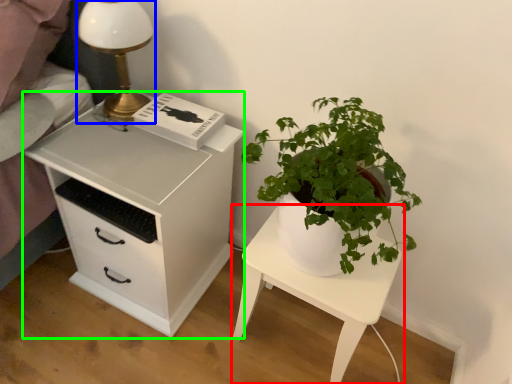
Question: Based on their relative distances, which object is nearer to nightstand (highlighted by a red box)? Choose from table lamp (highlighted by a blue box) and chest of drawers (highlighted by a green box).

Choices:
 (A) table lamp
 (B) chest of drawers

Answer: (B)